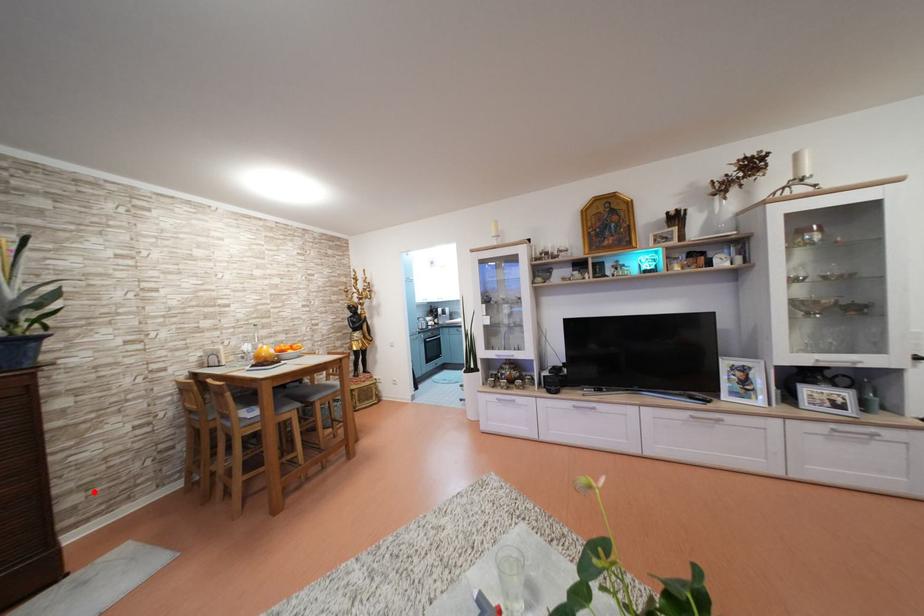
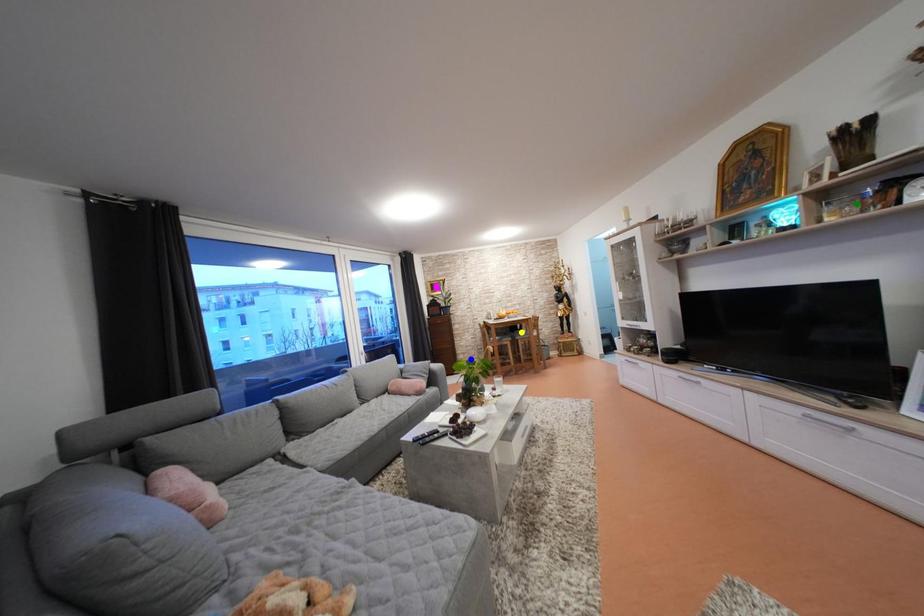
Question: I am providing you with two images of the same scene from different viewpoints. A red point is marked on the first image. You are given multiple points on the second image. Which mark in image 2 goes with the point in image 1?

Choices:
 (A) blue point
 (B) green point
 (C) yellow point

Answer: (A)